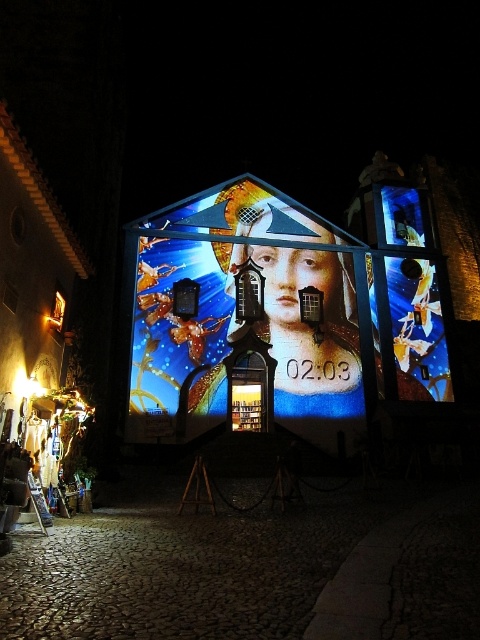
Does dark cobblestone alley at center appear over matte gold statue at center?

No.

Is point (139, 576) positioned in front of point (279, 256)?

Yes, it is in front of point (279, 256).

This screenshot has height=640, width=480. Find the location of `dark cobblestone alley at center`. dark cobblestone alley at center is located at coordinates (243, 566).

Who is lower down, shiny metallic billboard at center or dark cobblestone alley at center?

dark cobblestone alley at center

You are a GUI agent. You are given a task and a screenshot of the screen. Output one action in this format:
    pyautogui.click(x=<x>, y=<y>)
    Task: Click on the shiny metallic billboard at center
    Image resolution: width=480 pixels, height=640 pixels.
    Given the screenshot: What is the action you would take?
    pyautogui.click(x=286, y=316)

Between point (180, 388) and point (288, 275), which one is positioned in front?

Positioned in front is point (180, 388).

Is point (336, 336) positioned before point (319, 257)?

Yes, point (336, 336) is closer to viewer.

You are a GUI agent. You are given a task and a screenshot of the screen. Output one action in this format:
    pyautogui.click(x=<x>, y=<y>)
    Task: Click on the shiny metallic billboard at center
    The height and width of the screenshot is (640, 480).
    Given the screenshot: What is the action you would take?
    pyautogui.click(x=286, y=316)